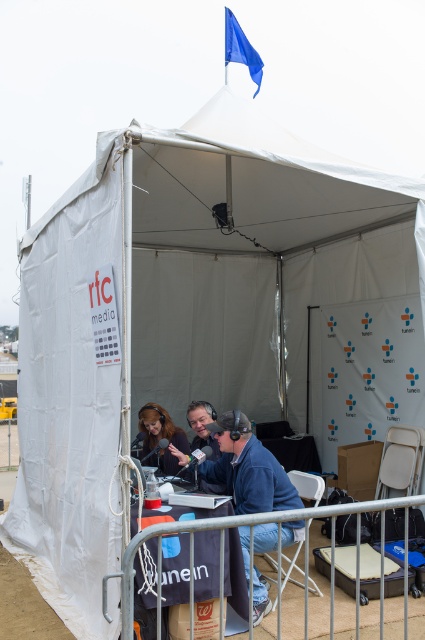
Question: Which point appears closest to the camera in this image?

Choices:
 (A) (234, 465)
 (B) (163, 458)
 (C) (322, 490)

Answer: (A)

Question: Can you confirm if blue fabric jacket at center is smaller than matte black headphones at center?

Choices:
 (A) yes
 (B) no

Answer: (B)

Question: Is blue fabric jacket at center positioned behind matte black headphones at center?

Choices:
 (A) yes
 (B) no

Answer: (B)

Question: Which of the following is the farthest from the observer?

Choices:
 (A) (263, 464)
 (B) (302, 481)

Answer: (B)

Question: Which object appears closest to the camera in this image?

Choices:
 (A) blue fabric jacket at center
 (B) white plastic chair at lower right

Answer: (A)

Question: Can you confirm if blue fabric jacket at center is thinner than white plastic chair at lower right?

Choices:
 (A) no
 (B) yes

Answer: (A)